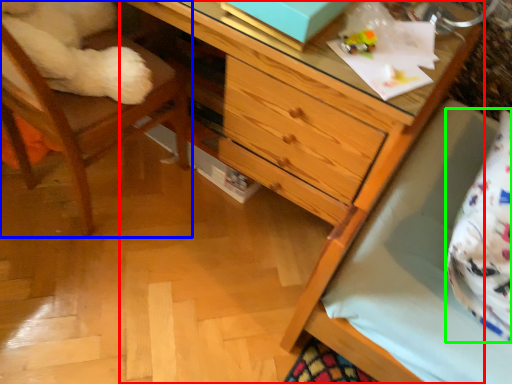
Question: Which is farther away from chest of drawers (highlighted by a red box)? chair (highlighted by a blue box) or pillow (highlighted by a green box)?

Choices:
 (A) chair
 (B) pillow

Answer: (A)